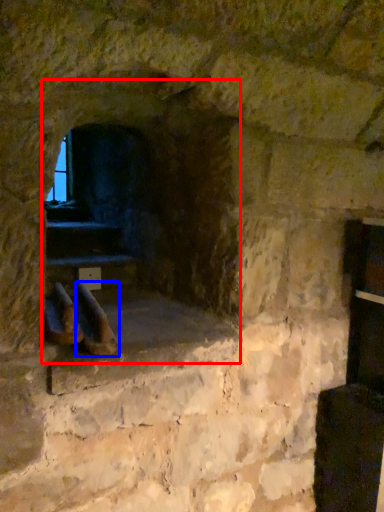
Question: Which point is closer to the camera, fireplace (highlighted by a red box) or footwear (highlighted by a blue box)?

Choices:
 (A) fireplace
 (B) footwear

Answer: (B)